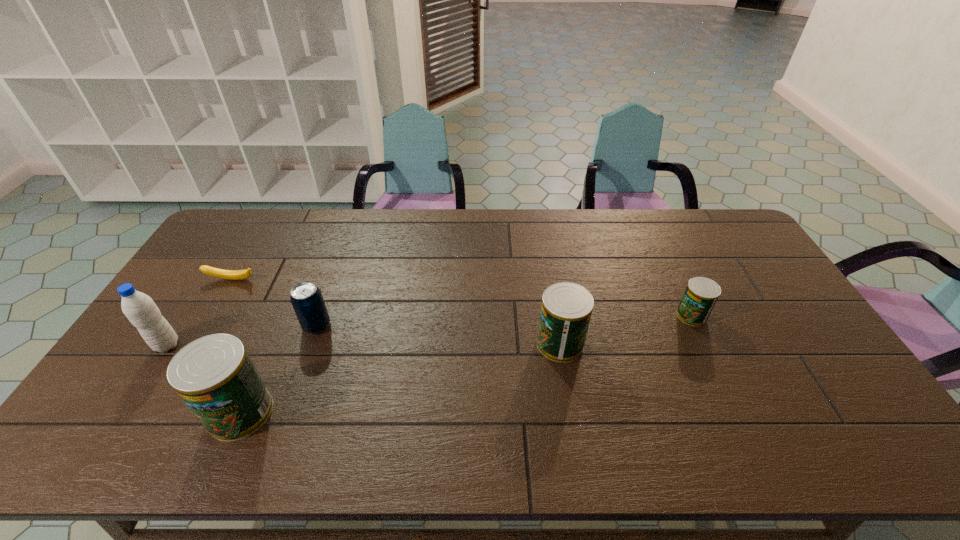
Image resolution: width=960 pixels, height=540 pixels. Identify the location of free point between the shortest object and the soda can. (275, 303).

Find the location of a particular element. free point between the second shortest object and the shortest object is located at coordinates (462, 298).

At what (x,y) coordinates should I click in order to perform the action: click on empty location between the nearest can and the fifth tallest object. Please return your answer as a coordinate pair (x, y). This screenshot has width=960, height=540. Looking at the image, I should click on (466, 364).

Find the location of `vacant area that lies between the farthest object and the second shortest object`. vacant area that lies between the farthest object and the second shortest object is located at coordinates (462, 298).

In order to click on unoccupied position between the rightmost object and the second can from left to right in this screenshot , I will do `click(626, 329)`.

Where is `vacant space that is in between the fourth tallest object and the nearest can`? The height and width of the screenshot is (540, 960). vacant space that is in between the fourth tallest object and the nearest can is located at coordinates 278,369.

The image size is (960, 540). Identify the location of the fifth closest object to the soda can. (701, 294).

Where is `object that ranks as the closest to the second object from right to left`? The height and width of the screenshot is (540, 960). object that ranks as the closest to the second object from right to left is located at coordinates (701, 294).

Locate an element on the screen. the second closest can to the nearest object is located at coordinates (701, 294).

At what (x,y) coordinates should I click in order to perform the action: click on can that stands as the closest to the shortest object. Please return your answer as a coordinate pair (x, y). Looking at the image, I should click on (214, 375).